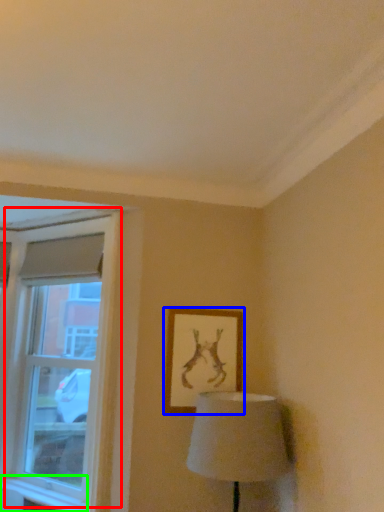
Question: Which is nearer to the window (highlighted by a red box)? picture frame (highlighted by a blue box) or window sill (highlighted by a green box).

Choices:
 (A) picture frame
 (B) window sill

Answer: (B)